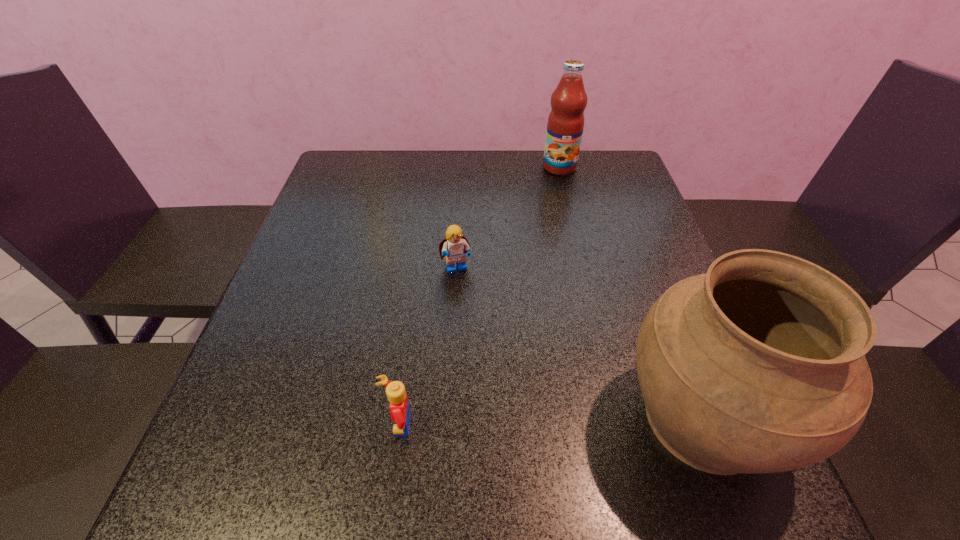
Identify the location of the nearer Lego. (399, 406).

I want to click on the left Lego, so click(399, 406).

Locate an element on the screen. The image size is (960, 540). urn is located at coordinates (758, 366).

Locate an element on the screen. The width and height of the screenshot is (960, 540). the third nearest object is located at coordinates (455, 246).

Identify the location of the right Lego. The height and width of the screenshot is (540, 960). (455, 246).

Identify the location of the farthest object. (565, 125).

Find the location of `vacant region located on the face of the nearer Lego`. vacant region located on the face of the nearer Lego is located at coordinates [x=305, y=426].

Locate an element on the screen. The width and height of the screenshot is (960, 540). free space located on the face of the nearer Lego is located at coordinates (258, 426).

Where is `vacant region located 0.280m on the face of the nearer Lego`? vacant region located 0.280m on the face of the nearer Lego is located at coordinates (217, 426).

I want to click on vacant space situated 0.390m on the left of the urn, so click(x=390, y=418).